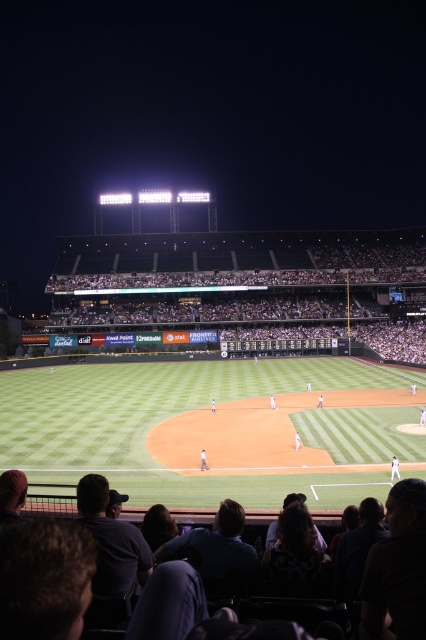
Who is taller, dark fabric seats at lower center or white fabric shirt at center?

white fabric shirt at center

Is dark fabric seats at lower center behind white fabric shirt at center?

No, dark fabric seats at lower center is closer to the viewer.

What do you see at coordinates (37, 573) in the screenshot? I see `dark fabric seats at lower center` at bounding box center [37, 573].

Locate an element on the screen. dark fabric seats at lower center is located at coordinates (37, 573).

Is point (11, 611) positioned after point (299, 440)?

No, it is not.

Between dark fabric seats at lower center and white fabric baseball player at center, which one has more height?

With more height is white fabric baseball player at center.

Locate an element on the screen. This screenshot has height=640, width=426. dark fabric seats at lower center is located at coordinates [x=37, y=573].

Image resolution: width=426 pixels, height=640 pixels. I want to click on dark fabric seats at lower center, so click(x=37, y=573).

Is dark fabric seats at lower center positioned in front of white uniform at center?

Yes, it is.

Does dark fabric seats at lower center appear over white uniform at center?

Yes.

Is point (57, 579) closer to camera compared to point (391, 481)?

Yes, it is in front of point (391, 481).

This screenshot has height=640, width=426. I want to click on dark fabric seats at lower center, so click(x=37, y=573).